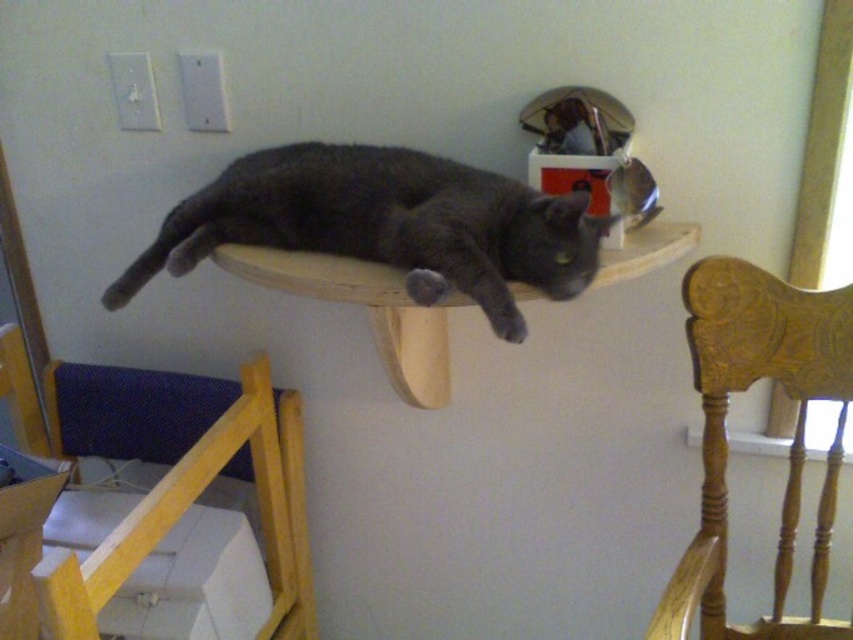
Question: Considering the relative positions of dark gray fur cat at center and wooden carved chair at right in the image provided, where is dark gray fur cat at center located with respect to wooden carved chair at right?

Choices:
 (A) above
 (B) below

Answer: (A)

Question: Which of the following is the closest to the observer?

Choices:
 (A) (233, 621)
 (B) (306, 150)
 (C) (757, 365)

Answer: (C)

Question: Which point is farther to the camera?

Choices:
 (A) (235, 160)
 (B) (850, 284)

Answer: (A)

Question: Is the position of dark gray fur cat at center less distant than that of wooden carved chair at right?

Choices:
 (A) no
 (B) yes

Answer: (B)

Question: From the image, what is the correct spatial relationship of wooden at left in relation to dark gray fur cat at center?

Choices:
 (A) below
 (B) above

Answer: (A)

Question: Which is nearer to the wooden carved chair at right?

Choices:
 (A) wooden at left
 (B) dark gray fur cat at center

Answer: (B)